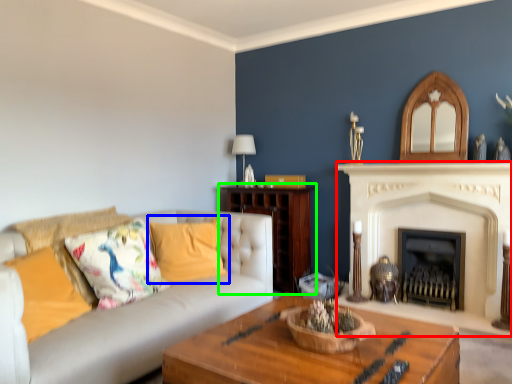
Question: Which object is positioned farthest from fireplace (highlighted by a red box)? Select from pillow (highlighted by a blue box) and hardwood (highlighted by a green box).

Choices:
 (A) pillow
 (B) hardwood

Answer: (A)